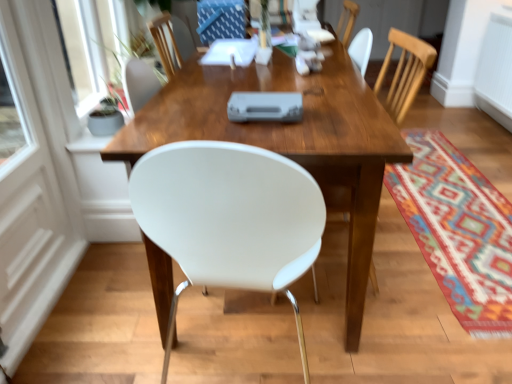
Question: From the image's perspective, is white glossy door at left located beneath multicolored woven mat at lower right?

Choices:
 (A) no
 (B) yes

Answer: (A)

Question: Does white glossy door at left have a smaller size compared to multicolored woven mat at lower right?

Choices:
 (A) no
 (B) yes

Answer: (A)

Question: Could you tell me if white glossy door at left is facing multicolored woven mat at lower right?

Choices:
 (A) no
 (B) yes

Answer: (B)

Question: Does white glossy door at left have a greater height compared to multicolored woven mat at lower right?

Choices:
 (A) no
 (B) yes

Answer: (B)

Question: Is the depth of white glossy door at left less than that of multicolored woven mat at lower right?

Choices:
 (A) no
 (B) yes

Answer: (B)

Question: Is wooden table at center taller or shorter than multicolored woven mat at lower right?

Choices:
 (A) short
 (B) tall

Answer: (B)

Question: Is wooden table at center wider or thinner than multicolored woven mat at lower right?

Choices:
 (A) wide
 (B) thin

Answer: (A)

Question: Relative to multicolored woven mat at lower right, is wooden table at center in front or behind?

Choices:
 (A) behind
 (B) front

Answer: (B)

Question: From the image's perspective, is wooden table at center located above or below multicolored woven mat at lower right?

Choices:
 (A) above
 (B) below

Answer: (A)

Question: Considering the positions of multicolored woven mat at lower right and wooden table at center in the image, is multicolored woven mat at lower right taller or shorter than wooden table at center?

Choices:
 (A) tall
 (B) short

Answer: (B)

Question: In the image, is multicolored woven mat at lower right positioned in front of or behind wooden table at center?

Choices:
 (A) behind
 (B) front

Answer: (A)

Question: Is multicolored woven mat at lower right wider or thinner than wooden table at center?

Choices:
 (A) thin
 (B) wide

Answer: (A)

Question: From the image's perspective, is multicolored woven mat at lower right located above or below wooden table at center?

Choices:
 (A) above
 (B) below

Answer: (B)

Question: Considering the relative positions of white glossy door at left and wooden table at center in the image provided, is white glossy door at left to the left or to the right of wooden table at center?

Choices:
 (A) left
 (B) right

Answer: (A)

Question: From a real-world perspective, is white glossy door at left physically located above or below wooden table at center?

Choices:
 (A) below
 (B) above

Answer: (B)